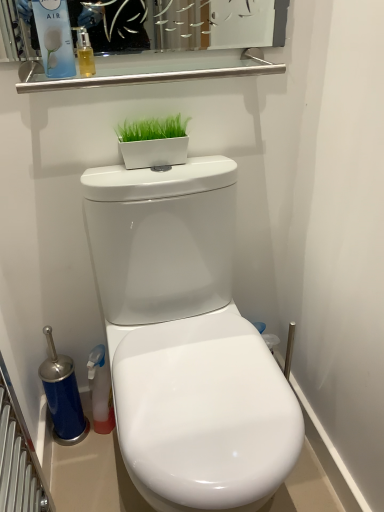
Identify the location of free location to the right of white glossy flowerpot at upper center. The height and width of the screenshot is (512, 384). (208, 163).